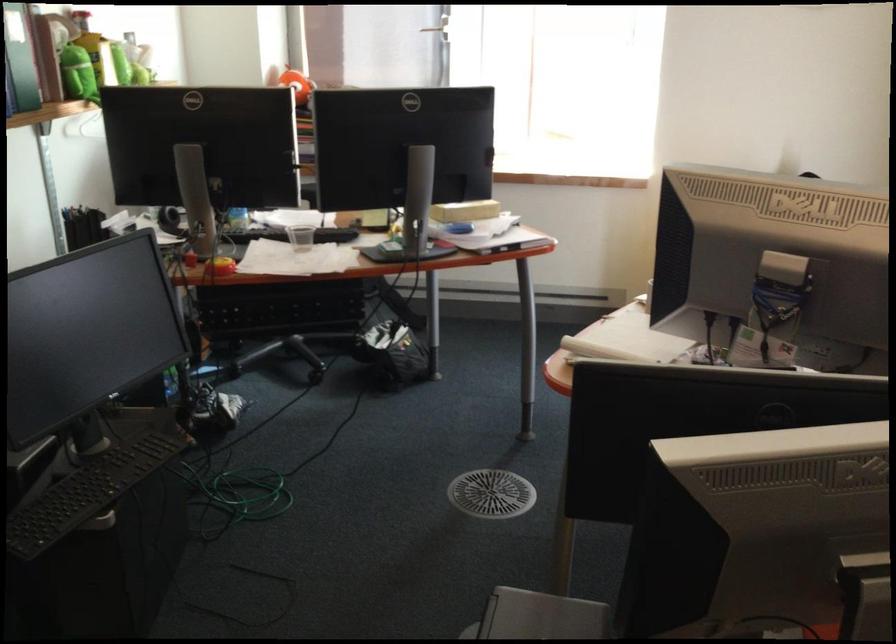
Find the location of a particular element. The image size is (896, 644). green plush toy is located at coordinates (78, 73).